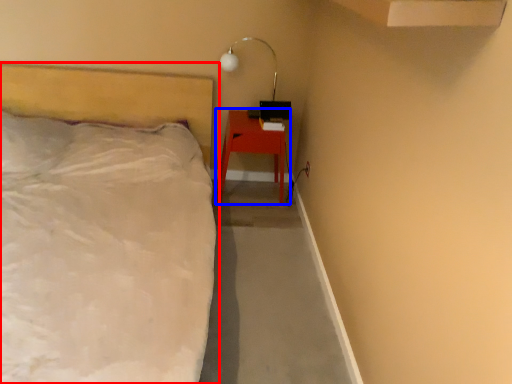
Question: Which point is further to the camera, bed (highlighted by a red box) or nightstand (highlighted by a blue box)?

Choices:
 (A) bed
 (B) nightstand

Answer: (B)